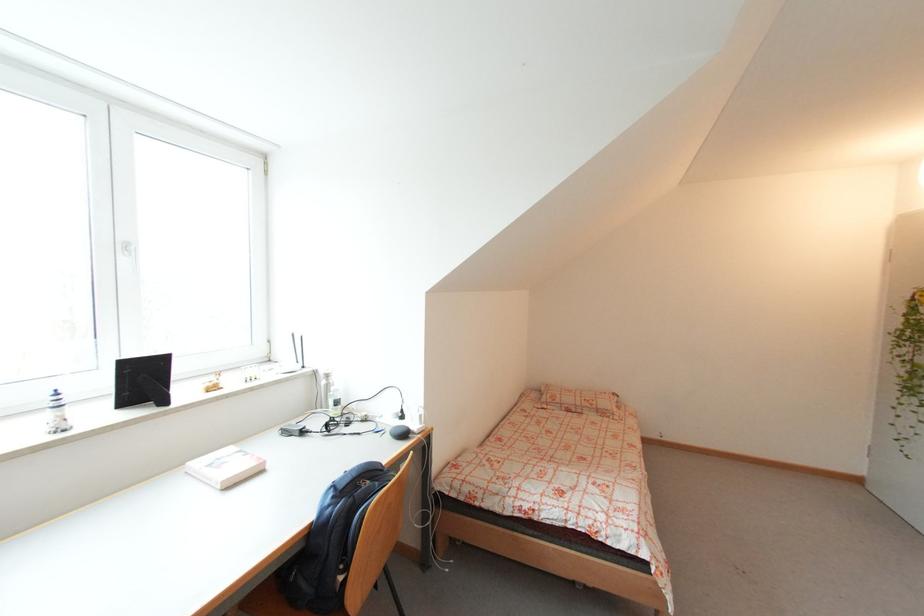
What do you see at coordinates (128, 243) in the screenshot? This screenshot has width=924, height=616. I see `the white window handle` at bounding box center [128, 243].